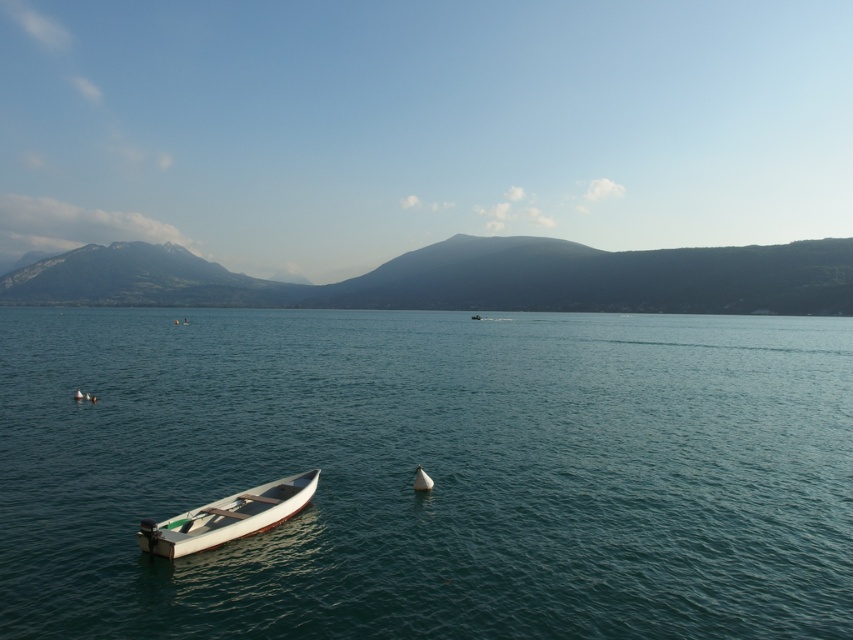
You are a sailor planning to dock your boat at the lakeside. You see the white matte sailboat at center and the white matte boat at center. Which one is more likely to fit in the docking area if the space is limited?

The white matte sailboat at center is smaller than the white matte boat at center, so it is more likely to fit in the docking area if the space is limited.

You are a photographer planning to capture the green textured mountain at center from a boat anchored near the center left of the frame. Given the mountain is at coordinates point 0.436, 0.550, where should you position your camera to ensure the mountain is centered in your shot?

To center the green textured mountain at center in your shot, position your camera so that the mountain is aligned with the center point of your viewfinder, which corresponds to the coordinates point (468,278) provided.

You are standing at the lakeside and want to reach the point marked as point (326, 483). The rowboat is anchored near the center left of the frame. Can you walk directly to that point along the shore?

The distance between you and point (326, 483) is 20.21 meters. However, the rowboat is anchored near the center left, which might block your direct path. You should check if there is an alternative route around the boat to reach the point safely.